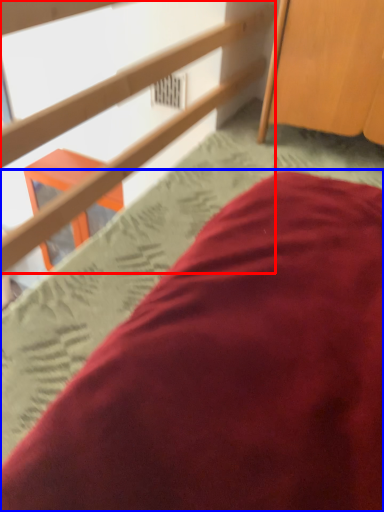
Question: Which object is further to the camera taking this photo, rail (highlighted by a red box) or bed (highlighted by a blue box)?

Choices:
 (A) rail
 (B) bed

Answer: (B)